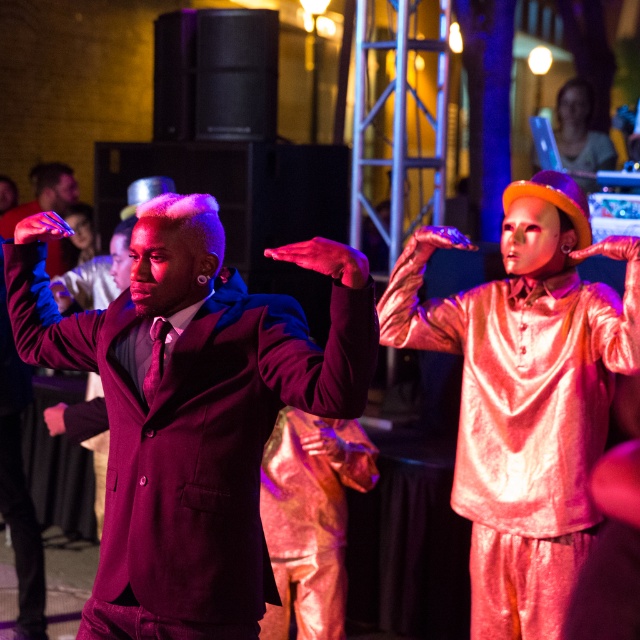
Who is lower down, matte black suit at center or shiny purple suit at center?

Positioned lower is shiny purple suit at center.

Which is in front, point (339, 307) or point (10, 410)?

Point (339, 307) is in front.

Locate an element on the screen. matte black suit at center is located at coordinates (193, 408).

Identify the location of shiny purple suit at center. This screenshot has width=640, height=640. (19, 480).

Is shiny purple suit at center thinner than smooth skin face at upper right?

Yes.

Find the location of a particular element. This screenshot has height=640, width=640. shiny purple suit at center is located at coordinates (19, 480).

Can you confirm if matte black suit at center is positioned to the left of smooth skin face at upper right?

Indeed, matte black suit at center is positioned on the left side of smooth skin face at upper right.

Measure the distance between point (120, 614) and camera.

A distance of 2.61 meters exists between point (120, 614) and camera.

The width and height of the screenshot is (640, 640). What are the coordinates of `matte black suit at center` in the screenshot? It's located at (193, 408).